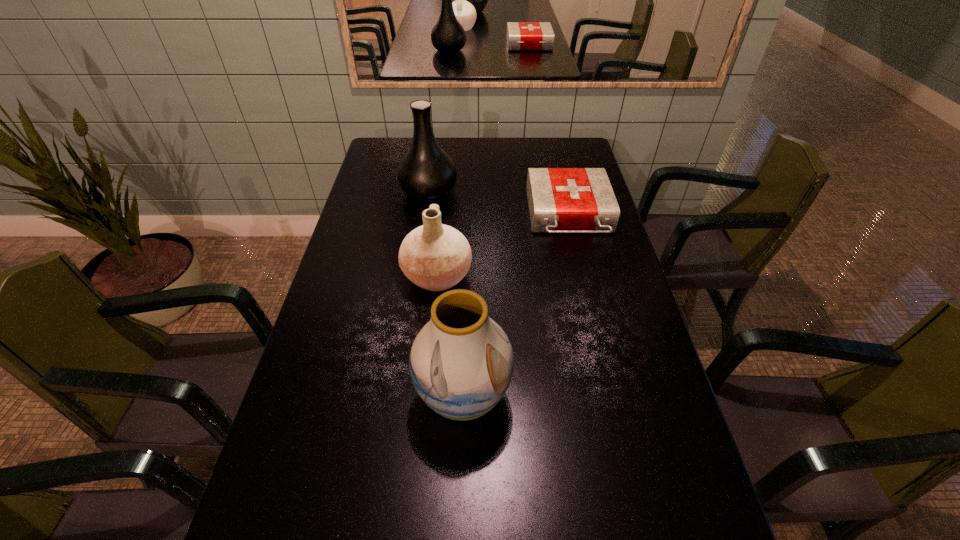
The width and height of the screenshot is (960, 540). In order to click on the farther vase in this screenshot , I will do `click(426, 172)`.

At what (x,y) coordinates should I click in order to perform the action: click on the nearer vase. Please return your answer as a coordinate pair (x, y). The height and width of the screenshot is (540, 960). Looking at the image, I should click on (461, 362).

The height and width of the screenshot is (540, 960). Identify the location of the second shortest object. (434, 256).

This screenshot has height=540, width=960. I want to click on the third farthest object, so click(x=434, y=256).

Locate an element on the screen. the first-aid kit is located at coordinates (561, 200).

The image size is (960, 540). What are the coordinates of `the shortest object` in the screenshot? It's located at (561, 200).

This screenshot has width=960, height=540. Identify the location of free spot located 0.230m on the front of the farther vase. (420, 252).

Locate an element on the screen. The height and width of the screenshot is (540, 960). free spot located 0.060m on the right of the nearer vase is located at coordinates (537, 396).

Where is `vacant area situated 0.160m to pour from the handle of the second nearest object`? The width and height of the screenshot is (960, 540). vacant area situated 0.160m to pour from the handle of the second nearest object is located at coordinates (525, 276).

This screenshot has height=540, width=960. I want to click on free space located 0.300m on the front side of the rightmost object, so click(x=594, y=321).